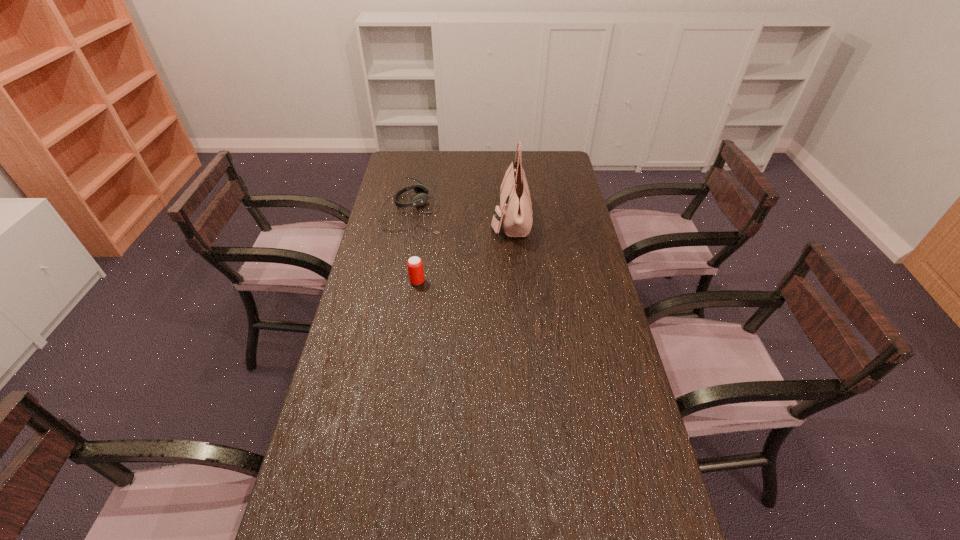
Locate an element on the screen. This screenshot has width=960, height=540. object present at the left edge is located at coordinates (420, 198).

This screenshot has width=960, height=540. I want to click on free space at the far edge of the desktop, so click(x=532, y=163).

In the image, there is a desktop. Where is `vacant space at the left edge`? vacant space at the left edge is located at coordinates (389, 266).

Where is `vacant space at the right edge of the desktop`? This screenshot has width=960, height=540. vacant space at the right edge of the desktop is located at coordinates (605, 429).

Where is `free space at the far left corner`? The image size is (960, 540). free space at the far left corner is located at coordinates (399, 174).

You are a GUI agent. You are given a task and a screenshot of the screen. Output one action in this format:
    pyautogui.click(x=<x>, y=<y>)
    Task: Click on the free space between the shortest object and the tallest object
    This screenshot has width=960, height=540.
    Given the screenshot: What is the action you would take?
    pyautogui.click(x=461, y=215)

You are a GUI agent. You are given a task and a screenshot of the screen. Output one action in this format:
    pyautogui.click(x=<x>, y=<y>)
    Task: Click on the free space between the second shortest object and the shortest object
    
    Given the screenshot: What is the action you would take?
    pyautogui.click(x=415, y=246)

The width and height of the screenshot is (960, 540). I want to click on vacant area between the headset and the rightmost object, so click(x=461, y=215).

The height and width of the screenshot is (540, 960). In order to click on object that is the second closest to the nearest object in this screenshot , I will do `click(516, 212)`.

Where is `object that stands as the second closest to the nearest object`? The width and height of the screenshot is (960, 540). object that stands as the second closest to the nearest object is located at coordinates [x=516, y=212].